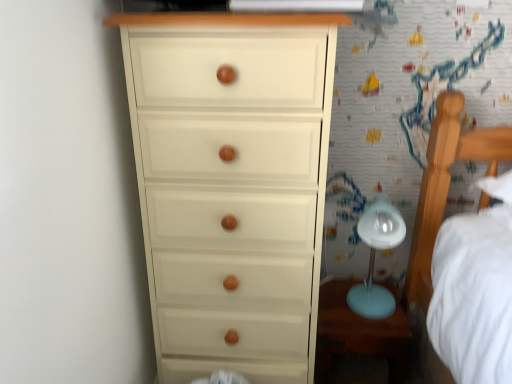
Where is `free location to the left of light blue plastic table lamp at right`? free location to the left of light blue plastic table lamp at right is located at coordinates (334, 306).